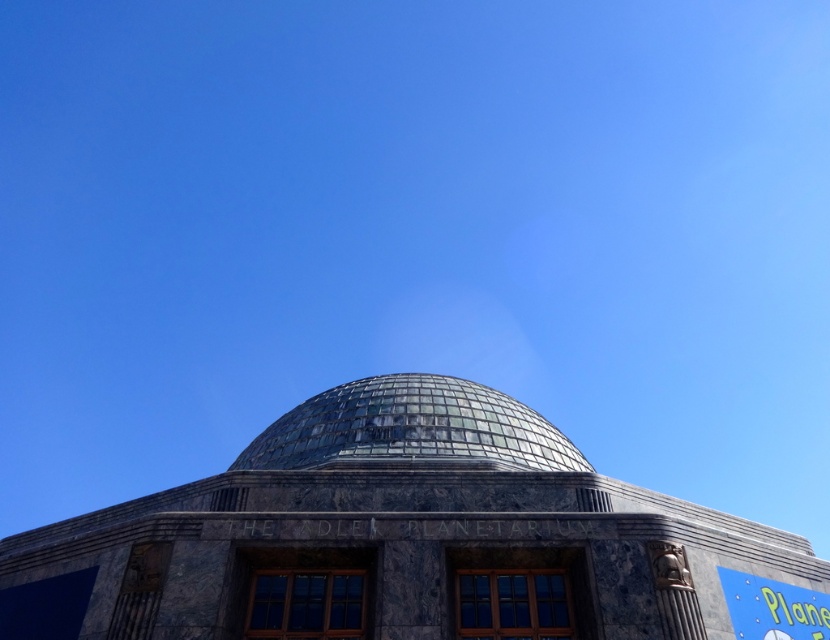
Question: Is transparent glass dome at center to the left of blue painted sign at lower right from the viewer's perspective?

Choices:
 (A) yes
 (B) no

Answer: (A)

Question: Is transparent glass dome at center below blue painted sign at lower right?

Choices:
 (A) no
 (B) yes

Answer: (B)

Question: Which point is closer to the camera?

Choices:
 (A) blue painted sign at lower right
 (B) transparent glass dome at center

Answer: (A)

Question: Can you confirm if transparent glass dome at center is thinner than blue painted sign at lower right?

Choices:
 (A) yes
 (B) no

Answer: (B)

Question: Among these objects, which one is farthest from the camera?

Choices:
 (A) blue painted sign at lower right
 (B) transparent glass dome at center

Answer: (B)

Question: Which point is farther to the camera?

Choices:
 (A) (750, 592)
 (B) (564, 458)

Answer: (B)